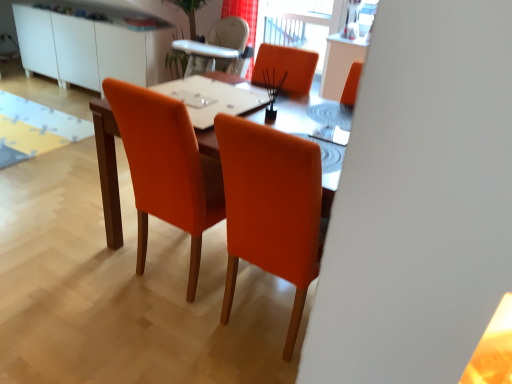
Question: Does transparent glass window screen at upper center have a smaller size compared to white glossy cabinet at upper left?

Choices:
 (A) yes
 (B) no

Answer: (A)

Question: Could you tell me if transparent glass window screen at upper center is turned towards white glossy cabinet at upper left?

Choices:
 (A) no
 (B) yes

Answer: (A)

Question: Can you confirm if transparent glass window screen at upper center is wider than white glossy cabinet at upper left?

Choices:
 (A) yes
 (B) no

Answer: (B)

Question: Is transparent glass window screen at upper center surrounding white glossy cabinet at upper left?

Choices:
 (A) yes
 (B) no

Answer: (B)

Question: Considering the relative sizes of transparent glass window screen at upper center and white glossy cabinet at upper left in the image provided, is transparent glass window screen at upper center taller than white glossy cabinet at upper left?

Choices:
 (A) yes
 (B) no

Answer: (A)

Question: Based on their positions, is white glossy cabinet at upper left located to the left or right of red fabric curtain at upper center?

Choices:
 (A) left
 (B) right

Answer: (A)

Question: Looking at their shapes, would you say white glossy cabinet at upper left is wider or thinner than red fabric curtain at upper center?

Choices:
 (A) wide
 (B) thin

Answer: (A)

Question: Considering the positions of white glossy cabinet at upper left and red fabric curtain at upper center in the image, is white glossy cabinet at upper left taller or shorter than red fabric curtain at upper center?

Choices:
 (A) tall
 (B) short

Answer: (A)

Question: Is point (33, 66) closer or farther from the camera than point (249, 77)?

Choices:
 (A) farther
 (B) closer

Answer: (A)

Question: Relative to transparent glass window screen at upper center, is red fabric curtain at upper center in front or behind?

Choices:
 (A) front
 (B) behind

Answer: (A)

Question: Considering the positions of red fabric curtain at upper center and transparent glass window screen at upper center in the image, is red fabric curtain at upper center taller or shorter than transparent glass window screen at upper center?

Choices:
 (A) tall
 (B) short

Answer: (B)

Question: Considering the positions of point (251, 64) and point (295, 16), is point (251, 64) closer or farther from the camera than point (295, 16)?

Choices:
 (A) closer
 (B) farther

Answer: (A)

Question: In terms of width, does red fabric curtain at upper center look wider or thinner when compared to transparent glass window screen at upper center?

Choices:
 (A) thin
 (B) wide

Answer: (B)

Question: In the image, is white glossy table at center positioned in front of or behind transparent glass window screen at upper center?

Choices:
 (A) behind
 (B) front

Answer: (B)

Question: From the image's perspective, relative to transparent glass window screen at upper center, is white glossy table at center above or below?

Choices:
 (A) below
 (B) above

Answer: (A)